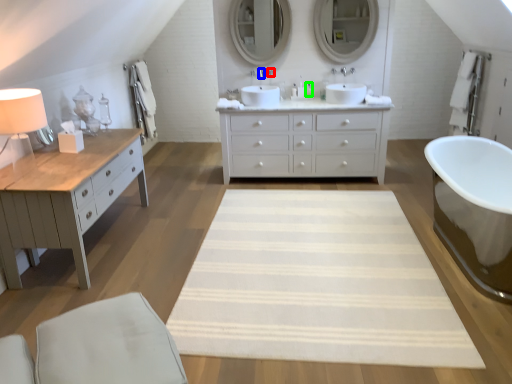
Question: Which object is the farthest from faucet (highlighted by a red box)? Choose among these: faucet (highlighted by a blue box) or toiletry (highlighted by a green box).

Choices:
 (A) faucet
 (B) toiletry

Answer: (B)